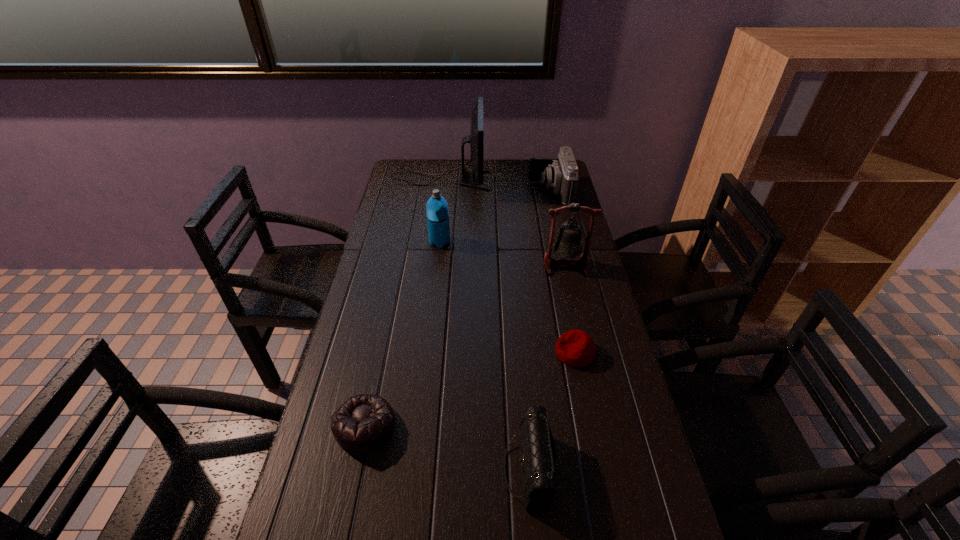
The height and width of the screenshot is (540, 960). I want to click on vacant region located on the seat area of the fifth farthest object, so click(x=492, y=353).

The image size is (960, 540). Find the location of `vacant space situated 0.270m on the seat area of the fifth farthest object`. vacant space situated 0.270m on the seat area of the fifth farthest object is located at coordinates (454, 353).

What are the coordinates of `vacant region located 0.250m on the seat area of the fifth farthest object` in the screenshot? It's located at (461, 353).

Where is `computer monitor present at the far edge`? computer monitor present at the far edge is located at coordinates (476, 138).

Identify the location of camera located in the far edge section of the desktop. (561, 174).

You are a GUI agent. You are given a task and a screenshot of the screen. Output one action in this format:
    pyautogui.click(x=<x>, y=<y>)
    Task: Click on the computer monitor at the left edge
    The image size is (960, 540).
    Given the screenshot: What is the action you would take?
    pyautogui.click(x=476, y=138)

Find the location of `beanbag located in the left edge section of the desktop`. beanbag located in the left edge section of the desktop is located at coordinates (364, 422).

Locate an element on the screen. bell that is at the right edge is located at coordinates (568, 244).

Image resolution: width=960 pixels, height=540 pixels. I want to click on camera that is at the right edge, so 561,174.

What are the coordinates of `beanbag present at the right edge` in the screenshot? It's located at (575, 348).